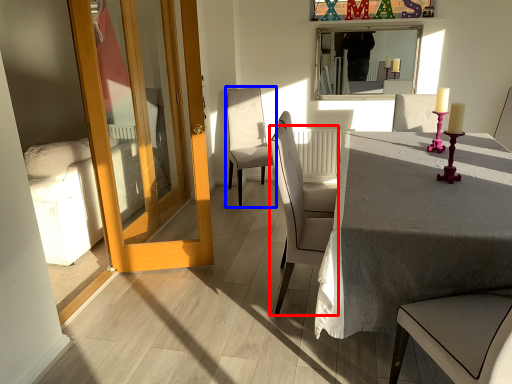
Question: Among these objects, which one is nearest to the camera, chair (highlighted by a red box) or chair (highlighted by a blue box)?

Choices:
 (A) chair
 (B) chair

Answer: (A)